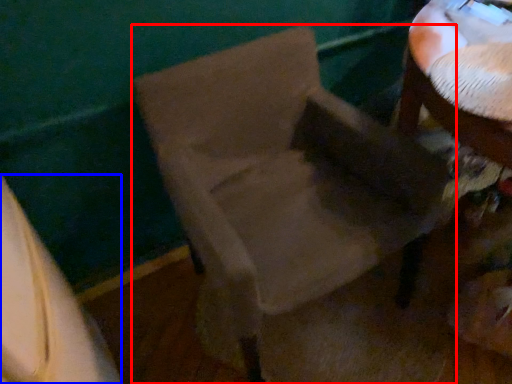
Question: Which of the following is the closest to the observer, chair (highlighted by a red box) or leftover (highlighted by a blue box)?

Choices:
 (A) chair
 (B) leftover

Answer: (B)